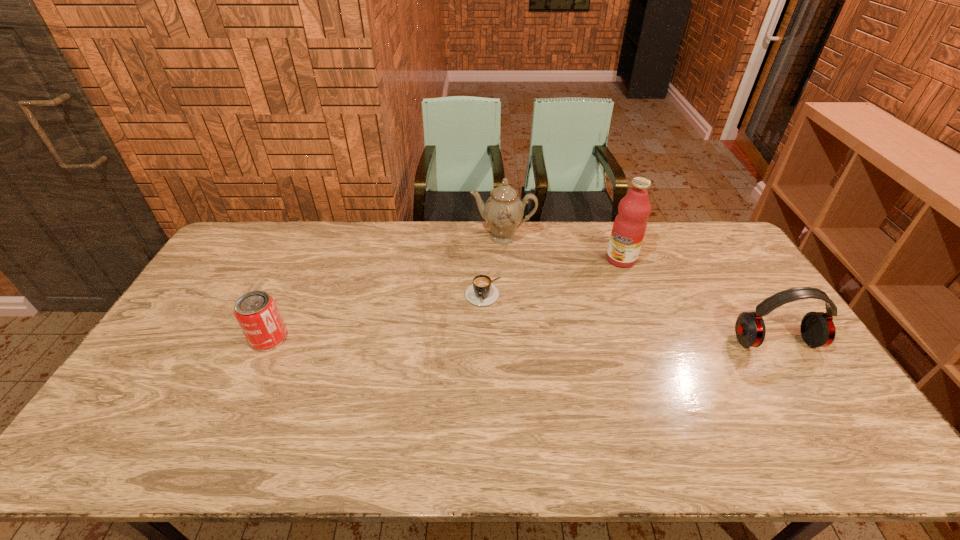
Locate an element on the screen. The height and width of the screenshot is (540, 960). blank space located 0.390m on the right of the leftmost object is located at coordinates (420, 338).

Where is `free location located on the ear cups of the earphone`? This screenshot has width=960, height=540. free location located on the ear cups of the earphone is located at coordinates (802, 382).

Locate an element on the screen. vacant space located 0.130m with the handle on the side of the shortest object is located at coordinates (474, 339).

At what (x,y) coordinates should I click in order to perform the action: click on vacant space located 0.130m with the handle on the side of the shortest object. Please return your answer as a coordinate pair (x, y). The image size is (960, 540). Looking at the image, I should click on (474, 339).

Where is `vacant space located with the handle on the side of the shortest object`? vacant space located with the handle on the side of the shortest object is located at coordinates (477, 328).

What are the coordinates of `free space located 0.230m on the label of the fruit juice` in the screenshot? It's located at (576, 301).

I want to click on vacant area situated 0.110m on the label of the fruit juice, so click(x=596, y=282).

This screenshot has height=540, width=960. Find the location of `vacant space located on the label of the fruit juice`. vacant space located on the label of the fruit juice is located at coordinates (590, 288).

The image size is (960, 540). Find the location of `free space located 0.060m on the spout of the farthest object`. free space located 0.060m on the spout of the farthest object is located at coordinates (496, 259).

The image size is (960, 540). In order to click on vacant space located 0.320m on the spout of the farthest object in this screenshot , I will do `click(486, 312)`.